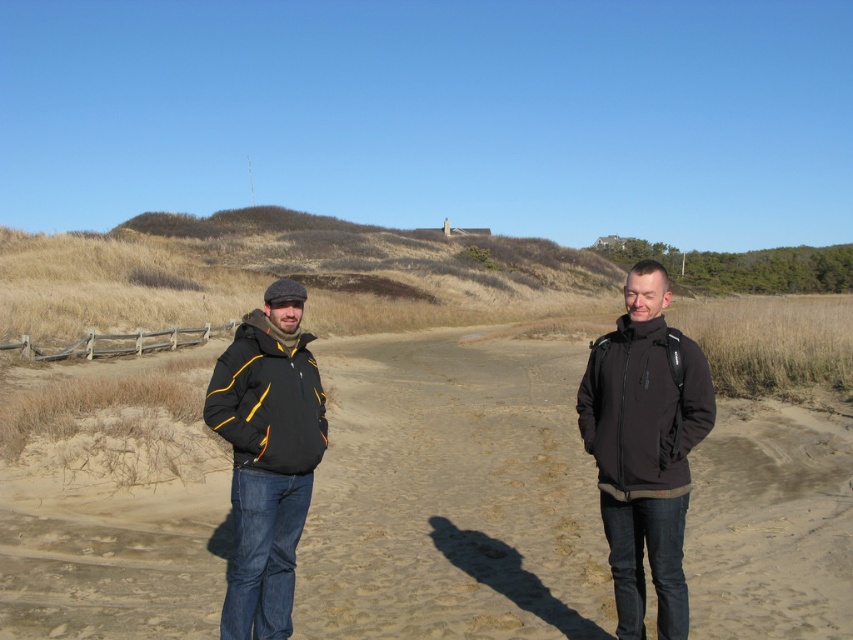
Is dull brown dirt at center further to the viewer compared to black softshell jacket at center?

Yes.

Can you confirm if dull brown dirt at center is positioned to the right of black softshell jacket at center?

Indeed, dull brown dirt at center is positioned on the right side of black softshell jacket at center.

Is point (526, 611) positioned before point (669, 339)?

No, (526, 611) is further to viewer.

This screenshot has height=640, width=853. I want to click on dull brown dirt at center, so click(x=451, y=496).

This screenshot has width=853, height=640. Describe the element at coordinates (451, 496) in the screenshot. I see `dull brown dirt at center` at that location.

Does dull brown dirt at center have a lesser height compared to matte black jacket at left?

Incorrect, dull brown dirt at center's height does not fall short of matte black jacket at left's.

Which is in front, point (200, 632) or point (242, 440)?

Positioned in front is point (242, 440).

Where is `dull brown dirt at center`? The height and width of the screenshot is (640, 853). dull brown dirt at center is located at coordinates pos(451,496).

Is point (637, 384) farther from viewer compared to point (267, 554)?

No, (637, 384) is in front of (267, 554).

Can you confirm if black softshell jacket at center is positioned above matte black jacket at left?

Incorrect, black softshell jacket at center is not positioned above matte black jacket at left.

Is point (665, 401) more distant than point (219, 394)?

No, it is in front of (219, 394).

Locate an element on the screen. Image resolution: width=853 pixels, height=640 pixels. black softshell jacket at center is located at coordinates (645, 448).